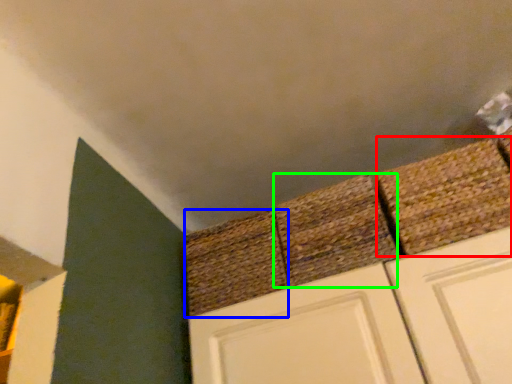
Question: Which is nearer to the brick (highlighted by a red box)? brick (highlighted by a blue box) or brick (highlighted by a green box).

Choices:
 (A) brick
 (B) brick

Answer: (B)